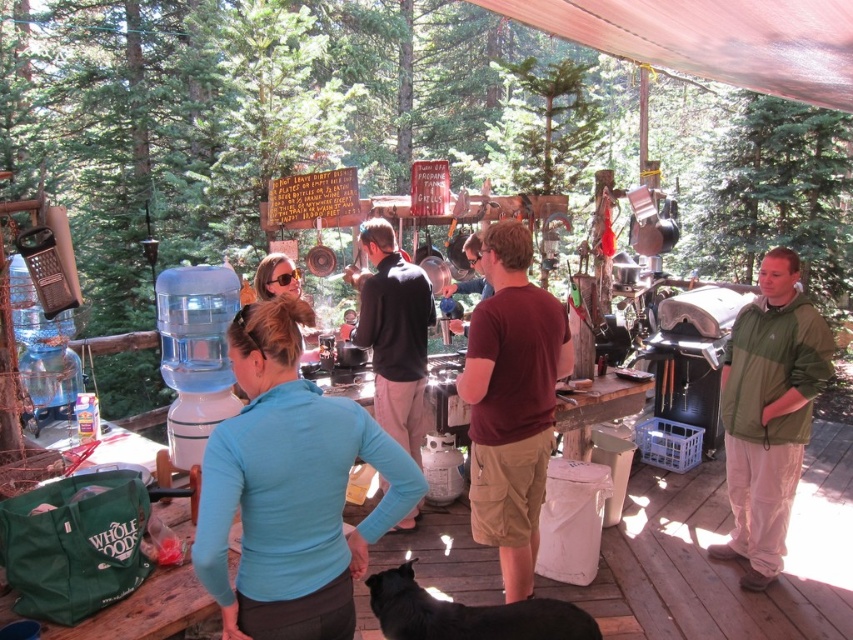
Who is more distant from viewer, (207,522) or (550,358)?

The point (550,358) is behind.

Is blue fabric shirt at center above maroon cotton t-shirt at center?

Indeed, blue fabric shirt at center is positioned over maroon cotton t-shirt at center.

Measure the distance between point (305, 380) and camera.

The distance of point (305, 380) from camera is 1.90 meters.

Image resolution: width=853 pixels, height=640 pixels. I want to click on blue fabric shirt at center, so click(x=289, y=490).

Between point (532, 333) and point (730, 401), which one is positioned behind?

The point (730, 401) is behind.

Between maroon cotton t-shirt at center and green fabric jacket at right, which one has less height?

Standing shorter between the two is maroon cotton t-shirt at center.

Locate an element on the screen. maroon cotton t-shirt at center is located at coordinates (511, 403).

At what (x,y) coordinates should I click in order to perform the action: click on maroon cotton t-shirt at center. Please return your answer as a coordinate pair (x, y). The height and width of the screenshot is (640, 853). Looking at the image, I should click on (511, 403).

Between point (309, 550) and point (364, 340), which one is positioned in front?

Point (309, 550) is in front.

Between blue fabric shirt at center and dark brown leather jacket at center, which one has more height?

With more height is dark brown leather jacket at center.

This screenshot has height=640, width=853. What do you see at coordinates (289, 490) in the screenshot?
I see `blue fabric shirt at center` at bounding box center [289, 490].

At what (x,y) coordinates should I click in order to perform the action: click on blue fabric shirt at center. Please return your answer as a coordinate pair (x, y). This screenshot has width=853, height=640. Looking at the image, I should click on (289, 490).